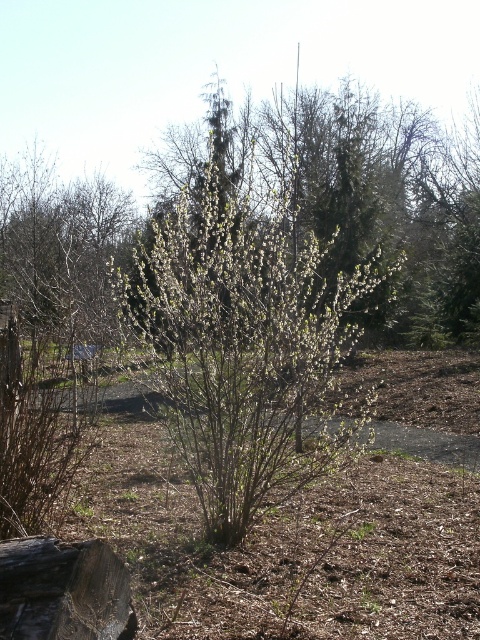
You are standing in the center of the scene and want to place a small decorative rock. Where should you place it so that it is directly above the brown mulch at center?

The brown mulch at center is located at the point with coordinates 0.855 on the x axis and 0.598 on the y axis. To place the decorative rock directly above it, position the rock at the same x coordinate of 0.855 but a higher y coordinate than 0.598.

You are a gardener assessing the growth of plants in a spring garden. You notice the green leafy bush at center and the rough wooden log at lower left. Which of these two has a greater height?

The green leafy bush at center has a greater height compared to the rough wooden log at lower left.

You are a gardener planning to plant a new flower bed between the brown mulch at center and the green leafy bush at center. Which of the two has a wider area to accommodate the flowers?

The green leafy bush at center has a wider area than the brown mulch at center, so it can accommodate the flowers better.